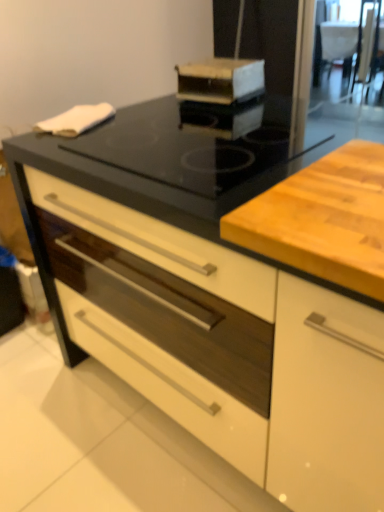
Find the location of a particular element. vacant space situated above black glass gas stove at center (from a real-world perspective) is located at coordinates (195, 141).